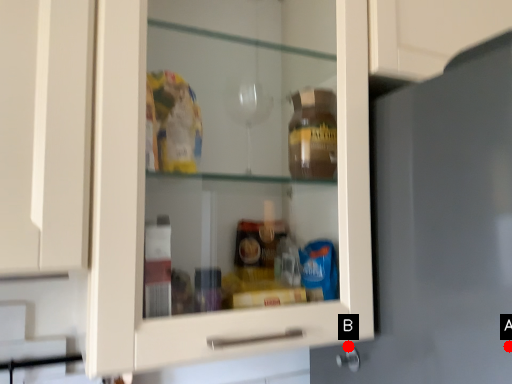
Question: Two points are circled on the image, labeled by A and B beside each circle. Which of the following is the farthest from the observer?

Choices:
 (A) A is further
 (B) B is further

Answer: (B)